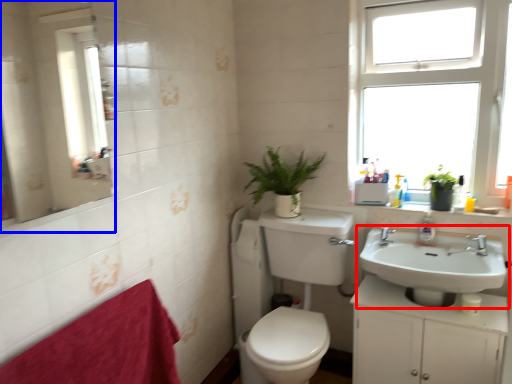
Question: Which object appears farthest to the camera in this image, sink (highlighted by a red box) or mirror (highlighted by a blue box)?

Choices:
 (A) sink
 (B) mirror

Answer: (A)